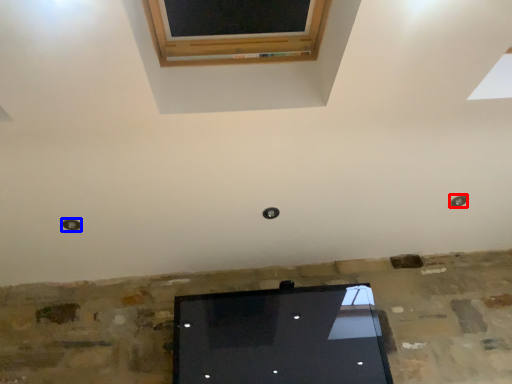
Question: Which object appears closest to the camera in this image, hole (highlighted by a red box) or hole (highlighted by a blue box)?

Choices:
 (A) hole
 (B) hole

Answer: (B)